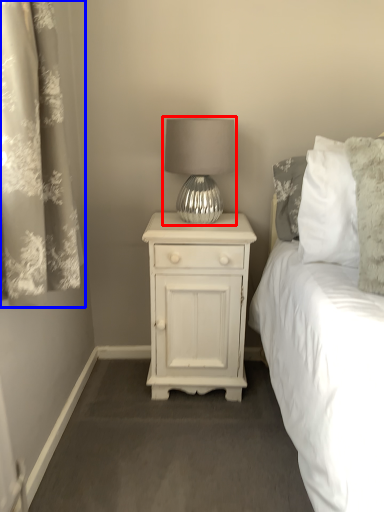
Question: Which point is closer to the camera, lamp (highlighted by a red box) or curtain (highlighted by a blue box)?

Choices:
 (A) lamp
 (B) curtain

Answer: (B)